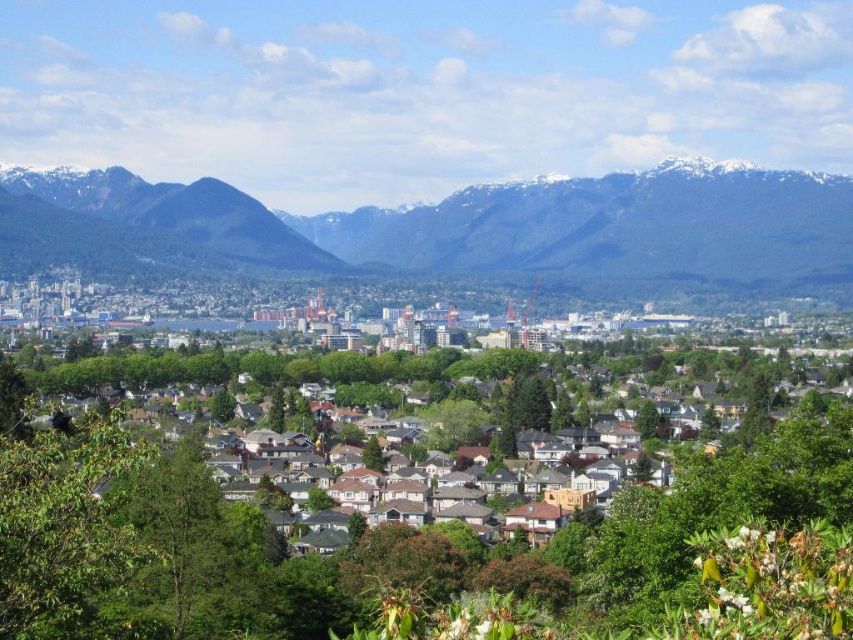
Does green textured mountains at center appear on the right side of white shingles at center?

Incorrect, green textured mountains at center is not on the right side of white shingles at center.

Is point (798, 248) closer to viewer compared to point (378, 508)?

No.

The width and height of the screenshot is (853, 640). Identify the location of green textured mountains at center. (480, 228).